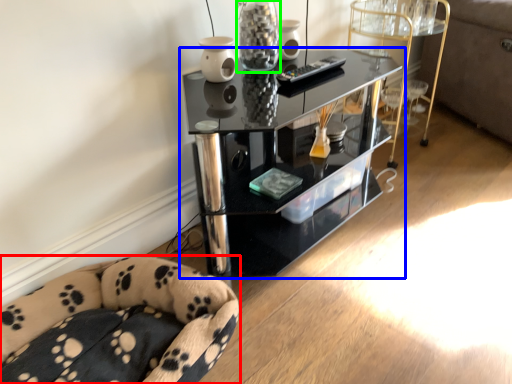
Question: Which is nearer to the furniture (highlighted by a red box)? shelf (highlighted by a blue box) or glass vase (highlighted by a green box).

Choices:
 (A) shelf
 (B) glass vase

Answer: (A)